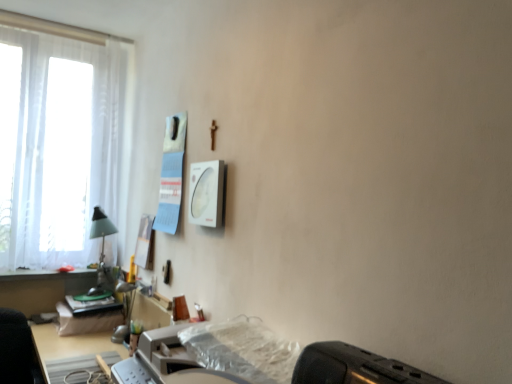
Locate an element on the screen. Image resolution: width=512 pixels, height=384 pixels. free space above black plastic toaster at lower right (from a real-world perspective) is located at coordinates (369, 361).